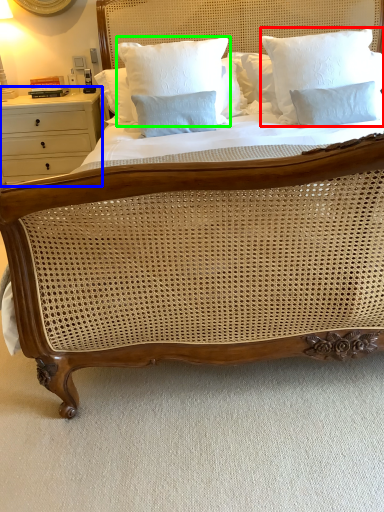
Question: Estimate the real-world distances between objects in this image. Which object is farther from pillow (highlighted by a red box), nightstand (highlighted by a blue box) or pillow (highlighted by a green box)?

Choices:
 (A) nightstand
 (B) pillow

Answer: (A)